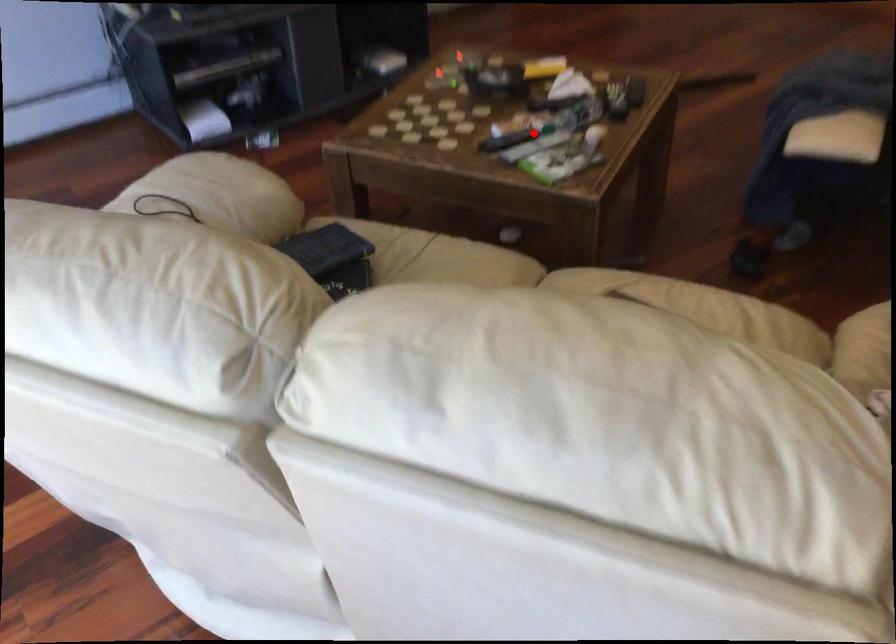
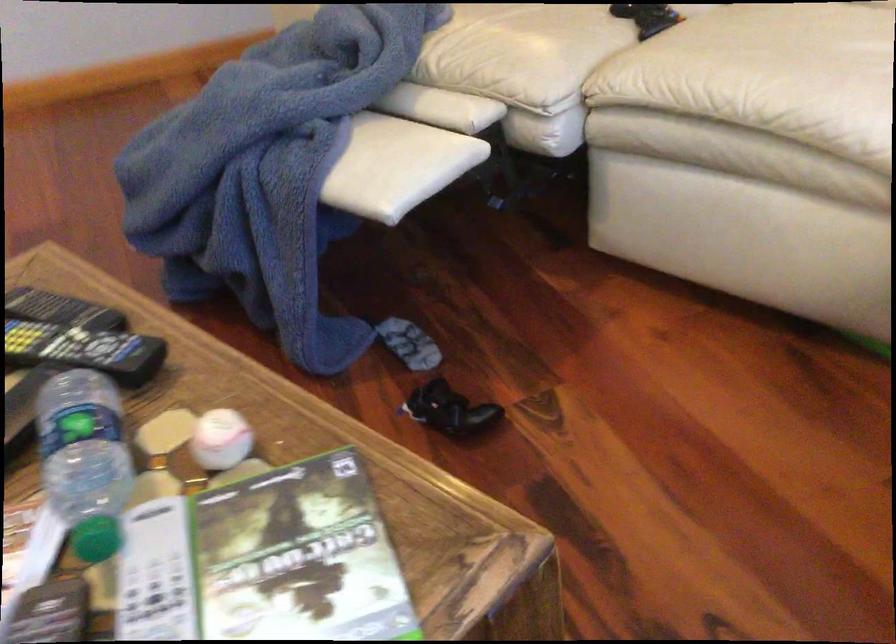
Locate, in the second image, the point that corresponds to the highlighted location in the first image.

(156, 574)